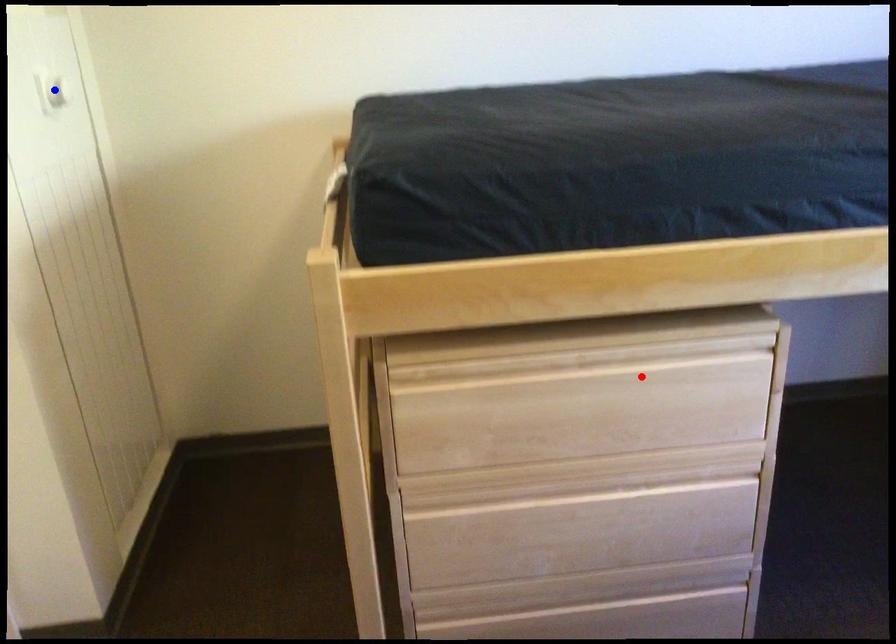
Question: Two points are marked on the image. Which point is closer to the camera?

Choices:
 (A) Blue point is closer.
 (B) Red point is closer.

Answer: (B)